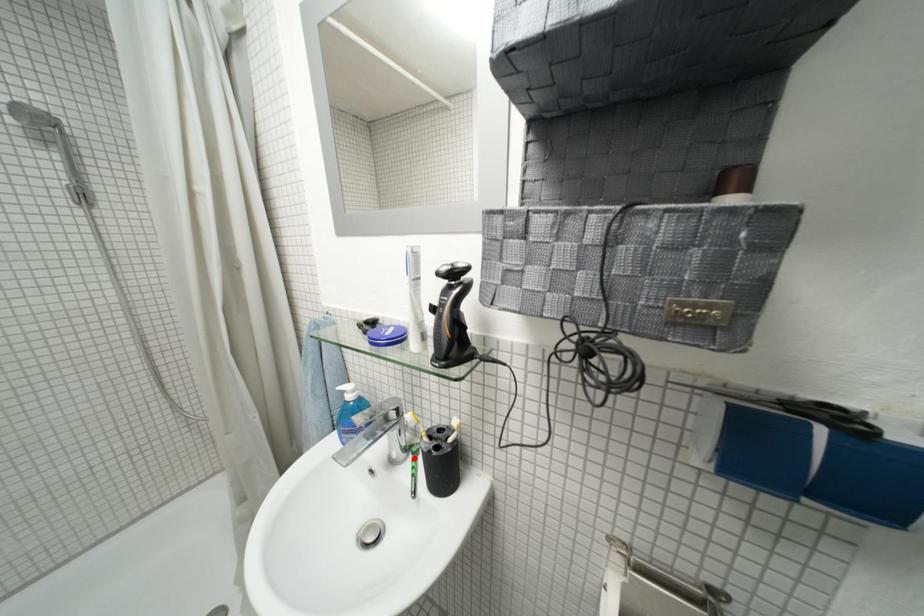
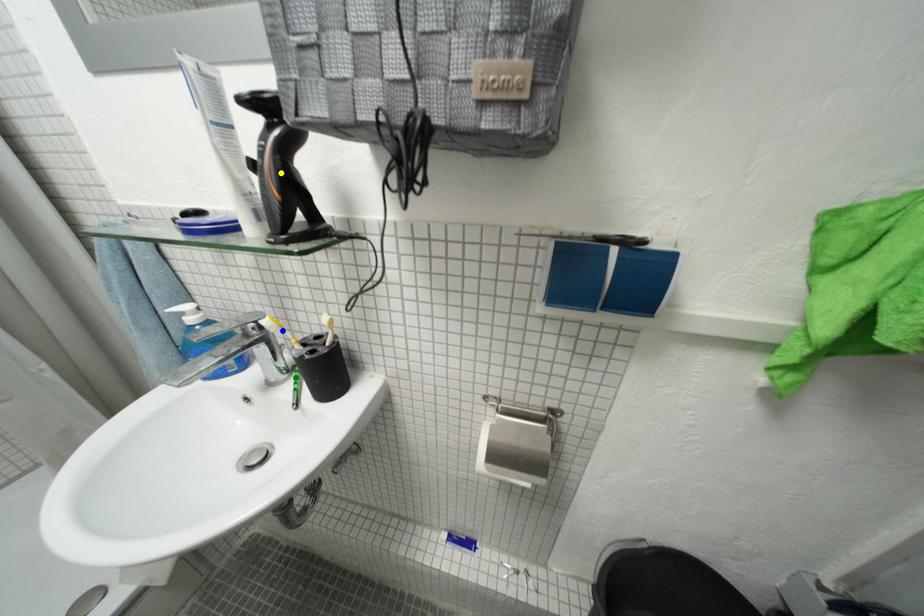
Question: I am providing you with two images of the same scene from different viewpoints. A red point is marked on the first image. You are given multiple points on the second image. In image 2, which mark is for the same physical point as the one in image 1?

Choices:
 (A) blue point
 (B) green point
 (C) yellow point

Answer: (B)